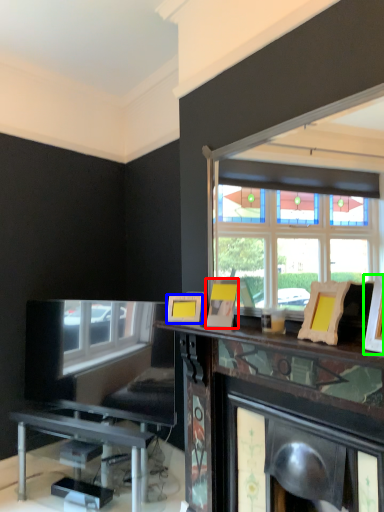
Question: Which object is positioned closest to picture frame (highlighted by a red box)? Select from picture frame (highlighted by a blue box) and picture frame (highlighted by a green box).

Choices:
 (A) picture frame
 (B) picture frame

Answer: (A)